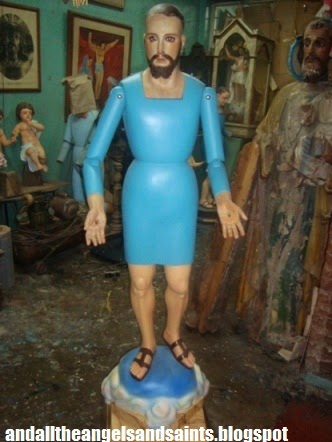
Find the location of a particular element. top of pedestal is located at coordinates (160, 374).